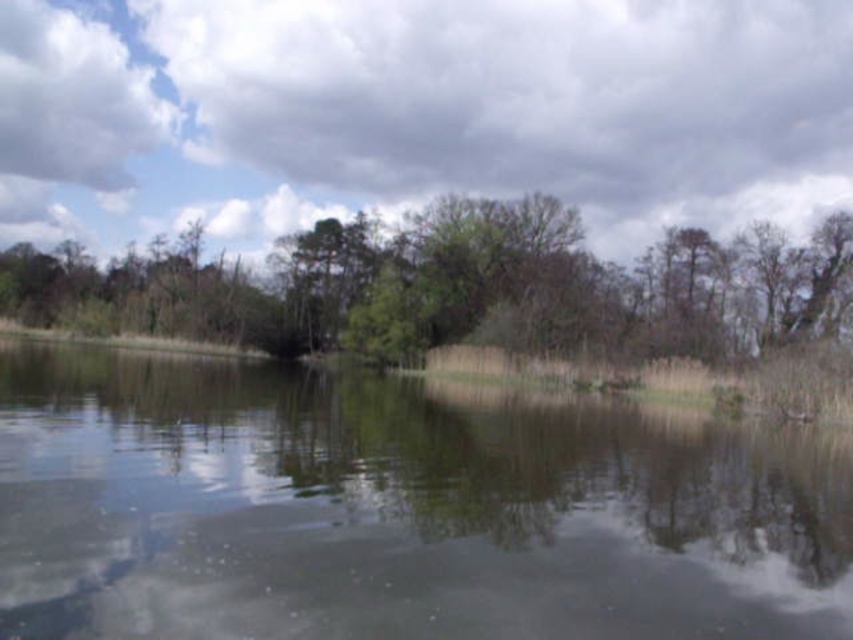
Question: Does clear water at center appear on the left side of green leafy tree at center?

Choices:
 (A) no
 (B) yes

Answer: (A)

Question: Is clear water at center further to the viewer compared to green leafy tree at center?

Choices:
 (A) no
 (B) yes

Answer: (A)

Question: Which of the following is the closest to the observer?

Choices:
 (A) green leafy tree at center
 (B) clear water at center

Answer: (B)

Question: In this image, where is clear water at center located relative to green leafy tree at center?

Choices:
 (A) above
 (B) below

Answer: (B)

Question: Which of the following is the closest to the observer?

Choices:
 (A) (155, 259)
 (B) (583, 397)

Answer: (B)

Question: Which object appears closest to the camera in this image?

Choices:
 (A) clear water at center
 (B) green leafy tree at center

Answer: (A)